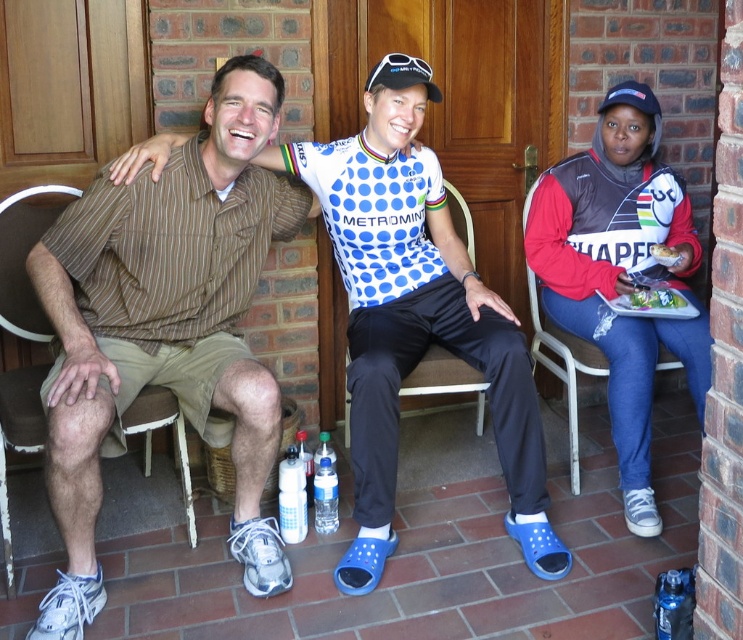
You are standing at the origin point in the image. Which direction should you move to reach the brown wood chair at left?

The brown wood chair at left is located at point (25, 257), so you should move towards the left and slightly forward to reach it.

You are a delivery person who needs to place a package on the table between the metallic silver chair at right and the white paper plate at center. The package requires 50 centimeters of space. Is there enough space?

The metallic silver chair at right is 50.42 centimeters away from the white paper plate at center, so yes, there is enough space to place the package between the metallic silver chair at right and the white paper plate at center since the distance is slightly more than required.